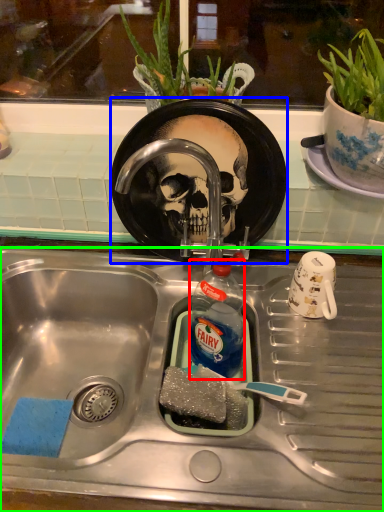
Question: Which object is the farthest from bottle (highlighted by a red box)? Choose among these: plate (highlighted by a blue box) or sink (highlighted by a green box).

Choices:
 (A) plate
 (B) sink

Answer: (A)